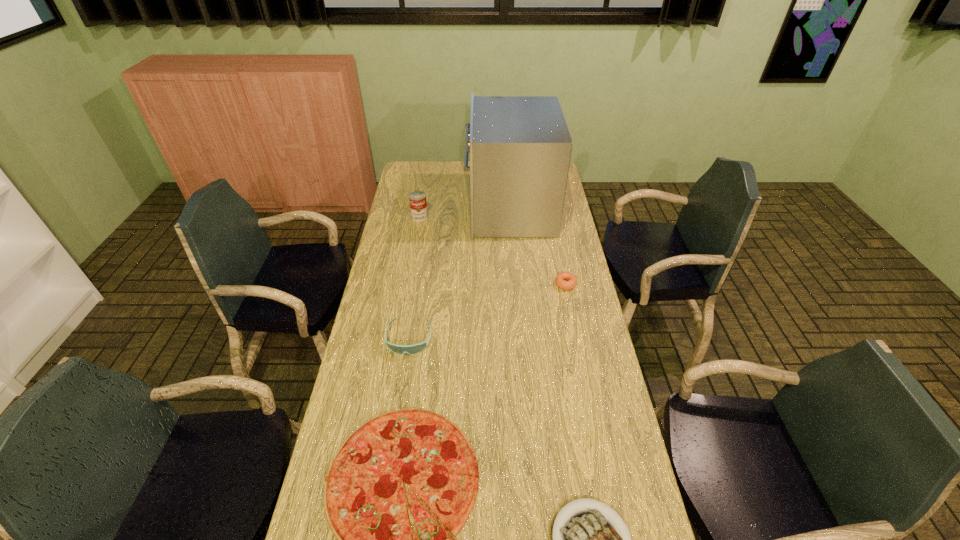
Where is `toaster oven`? The width and height of the screenshot is (960, 540). toaster oven is located at coordinates point(520,147).

What are the coordinates of `the second tallest object` in the screenshot? It's located at (417, 199).

Where is `the fourth farthest object`? This screenshot has width=960, height=540. the fourth farthest object is located at coordinates (416, 348).

Identify the location of goggles. (416, 348).

You are a GUI agent. You are given a task and a screenshot of the screen. Output one action in this format:
    pyautogui.click(x=<x>, y=<y>)
    Task: Click on the doughnut
    This screenshot has width=960, height=540.
    Given the screenshot: What is the action you would take?
    560,280

At what (x,y) coordinates should I click in order to perform the action: click on vacant area located on the front panel of the tallest object. Please return your answer as a coordinate pair (x, y). Image resolution: width=960 pixels, height=540 pixels. Looking at the image, I should click on pyautogui.click(x=449, y=210).

Find the location of `vacant space located 0.340m on the front panel of the tallest object`. vacant space located 0.340m on the front panel of the tallest object is located at coordinates (394, 210).

You are a GUI agent. You are given a task and a screenshot of the screen. Output one action in this format:
    pyautogui.click(x=<x>, y=<y>)
    Task: Click on the free point located 0.320m on the front panel of the tallest object
    The image size is (960, 540).
    Given the screenshot: What is the action you would take?
    pyautogui.click(x=397, y=210)

This screenshot has width=960, height=540. I want to click on vacant area situated 0.090m on the front label of the can, so click(417, 234).

I want to click on vacant region located on the front-facing side of the fourth shortest object, so click(x=403, y=379).